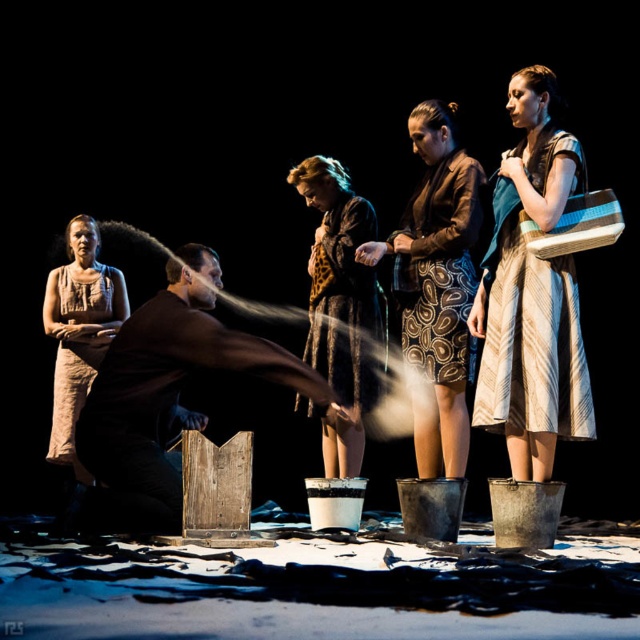
You are a costume designer observing the theatrical scene. You need to determine which garment takes up more horizontal space in the image. Which one is wider between the striped fabric dress at right and the brown textured skirt at center?

The brown textured skirt at center is wider than the striped fabric dress at right, so the brown textured skirt at center takes up more horizontal space.

You are a costume designer reviewing the image of a theatrical performance. You need to determine which garment takes up more space in the scene between the brown textured skirt at center and the beige textured dress at left. Which one is larger?

The brown textured skirt at center has a larger size compared to the beige textured dress at left, so the brown textured skirt at center takes up more space in the scene.